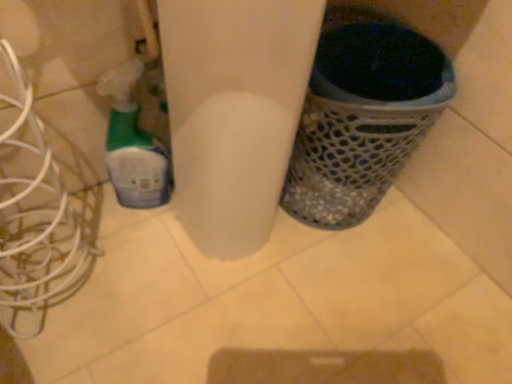
Question: From a real-world perspective, is white metallic wires at left located beneath metallic mesh waste bin at right?

Choices:
 (A) no
 (B) yes

Answer: (A)

Question: Can you confirm if white metallic wires at left is smaller than metallic mesh waste bin at right?

Choices:
 (A) no
 (B) yes

Answer: (B)

Question: From a real-world perspective, is white metallic wires at left located higher than metallic mesh waste bin at right?

Choices:
 (A) yes
 (B) no

Answer: (A)

Question: Is white metallic wires at left to the left of metallic mesh waste bin at right from the viewer's perspective?

Choices:
 (A) no
 (B) yes

Answer: (B)

Question: Is white metallic wires at left positioned with its back to metallic mesh waste bin at right?

Choices:
 (A) no
 (B) yes

Answer: (A)

Question: Does white metallic wires at left have a lesser width compared to metallic mesh waste bin at right?

Choices:
 (A) no
 (B) yes

Answer: (B)

Question: Is white metallic wires at left to the left of translucent plastic spray bottle at left from the viewer's perspective?

Choices:
 (A) yes
 (B) no

Answer: (A)

Question: Is white metallic wires at left outside translucent plastic spray bottle at left?

Choices:
 (A) yes
 (B) no

Answer: (A)

Question: From the image's perspective, does white metallic wires at left appear higher than translucent plastic spray bottle at left?

Choices:
 (A) no
 (B) yes

Answer: (A)

Question: Is the depth of white metallic wires at left less than that of translucent plastic spray bottle at left?

Choices:
 (A) no
 (B) yes

Answer: (B)

Question: Is the depth of white metallic wires at left greater than that of translucent plastic spray bottle at left?

Choices:
 (A) yes
 (B) no

Answer: (B)

Question: Can you confirm if white metallic wires at left is thinner than translucent plastic spray bottle at left?

Choices:
 (A) no
 (B) yes

Answer: (A)

Question: Is translucent plastic spray bottle at left outside of white metallic wires at left?

Choices:
 (A) no
 (B) yes

Answer: (B)